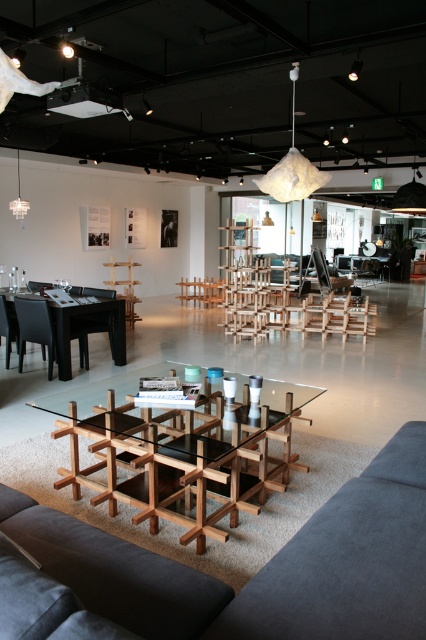
You are a visitor in the showroom and want to place a large plant between the wooden grid table at center and the black glossy table at left. Based on their positions, which table should the plant be closer to?

The wooden grid table at center is in front of the black glossy table at left, so the plant should be placed closer to the wooden grid table at center to maintain proper spacing between them.

You are standing in the showroom and want to take a photo of the two points mentioned. Which point, point (363, 605) or point (190, 452), will appear larger in your camera view?

Point (363, 605) is closer to the camera than point (190, 452), so it will appear larger in the camera view.

You are a furniture designer evaluating the layout of the showroom. You need to determine if the black glossy table at left can be placed under the wooden chair at left to save space. Can it fit vertically?

The black glossy table at left is not as tall as the wooden chair at left, so it can fit vertically under the wooden chair at left since its height is less than the chair.